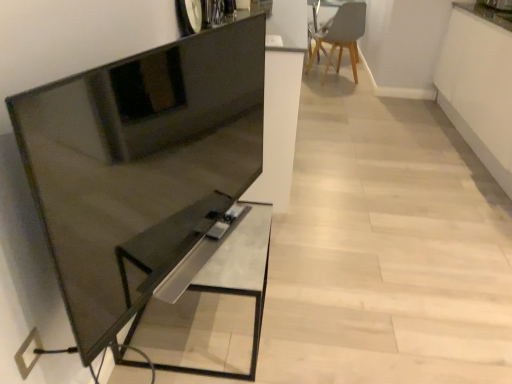
Image resolution: width=512 pixels, height=384 pixels. What do you see at coordinates (140, 165) in the screenshot?
I see `matte black tv stand at left` at bounding box center [140, 165].

The width and height of the screenshot is (512, 384). In order to click on metallic silver table at center in this screenshot , I will do `click(214, 309)`.

The width and height of the screenshot is (512, 384). I want to click on matte gray chair at upper right, so click(x=341, y=35).

Who is bigger, metallic silver table at center or matte black tv stand at left?

metallic silver table at center.

From the picture: Can you tell me how much metallic silver table at center and matte black tv stand at left differ in facing direction?

There is a 17.9-degree angle between the facing directions of metallic silver table at center and matte black tv stand at left.

Is metallic silver table at center outside of matte black tv stand at left?

metallic silver table at center lies outside matte black tv stand at left's area.

Does metallic silver table at center lie behind matte black tv stand at left?

Yes, it is.

Looking at this image, from a real-world perspective, is metallic silver table at center positioned under matte gray chair at upper right based on gravity?

Yes, from a real-world perspective, metallic silver table at center is below matte gray chair at upper right.

From the image's perspective, does metallic silver table at center appear lower than matte gray chair at upper right?

Yes.

In terms of size, does metallic silver table at center appear bigger or smaller than matte gray chair at upper right?

Considering their sizes, metallic silver table at center takes up less space than matte gray chair at upper right.

Can you confirm if metallic silver table at center is wider than matte gray chair at upper right?

In fact, metallic silver table at center might be narrower than matte gray chair at upper right.

Does matte gray chair at upper right turn towards matte black tv stand at left?

No, matte gray chair at upper right is not oriented towards matte black tv stand at left.

From a real-world perspective, between matte gray chair at upper right and matte black tv stand at left, who is vertically lower?

matte gray chair at upper right.

In the image, is matte gray chair at upper right positioned in front of or behind matte black tv stand at left?

Visually, matte gray chair at upper right is located behind matte black tv stand at left.

How different are the orientations of matte gray chair at upper right and matte black tv stand at left in degrees?

125 degrees separate the facing orientations of matte gray chair at upper right and matte black tv stand at left.

Consider the image. Considering the relative sizes of matte gray chair at upper right and metallic silver table at center in the image provided, is matte gray chair at upper right thinner than metallic silver table at center?

Incorrect, the width of matte gray chair at upper right is not less than that of metallic silver table at center.

Considering the relative sizes of matte gray chair at upper right and metallic silver table at center in the image provided, is matte gray chair at upper right bigger than metallic silver table at center?

Correct, matte gray chair at upper right is larger in size than metallic silver table at center.

Would you say matte gray chair at upper right is inside or outside metallic silver table at center?

matte gray chair at upper right is spatially situated outside metallic silver table at center.

Which is behind, point (97, 169) or point (359, 36)?

Positioned behind is point (359, 36).

Who is more distant, matte black tv stand at left or matte gray chair at upper right?

A: matte gray chair at upper right is behind.

Choose the correct answer: Is matte black tv stand at left inside matte gray chair at upper right or outside it?

matte black tv stand at left exists outside the volume of matte gray chair at upper right.

Is matte black tv stand at left at the left side of matte gray chair at upper right?

Yes, matte black tv stand at left is to the left of matte gray chair at upper right.

Is matte black tv stand at left aimed at metallic silver table at center?

No, matte black tv stand at left is not facing towards metallic silver table at center.

The width and height of the screenshot is (512, 384). Find the location of `entertainment center that appears in front of the metallic silver table at center`. entertainment center that appears in front of the metallic silver table at center is located at coordinates (140, 165).

Does matte black tv stand at left have a larger size compared to metallic silver table at center?

No.

From the picture: Who is taller, matte black tv stand at left or metallic silver table at center?

With more height is matte black tv stand at left.

Find the location of a particular element. entertainment center lying on the right of metallic silver table at center is located at coordinates (140, 165).

There is a metallic silver table at center. Where is `chair above it (from a real-world perspective)`? Image resolution: width=512 pixels, height=384 pixels. chair above it (from a real-world perspective) is located at coordinates (341, 35).

Based on their spatial positions, is metallic silver table at center or matte gray chair at upper right further from matte black tv stand at left?

The object further to matte black tv stand at left is matte gray chair at upper right.

In the scene shown: When comparing their distances from matte gray chair at upper right, does matte black tv stand at left or metallic silver table at center seem further?

metallic silver table at center is positioned further to the anchor matte gray chair at upper right.

Based on the photo, which object lies further to the anchor point matte black tv stand at left, matte gray chair at upper right or metallic silver table at center?

matte gray chair at upper right is positioned further to the anchor matte black tv stand at left.

Which object lies further to the anchor point matte gray chair at upper right, metallic silver table at center or matte black tv stand at left?

metallic silver table at center is positioned further to the anchor matte gray chair at upper right.

Estimate the real-world distances between objects in this image. Which object is further from metallic silver table at center, matte gray chair at upper right or matte black tv stand at left?

matte gray chair at upper right.

When comparing their distances from metallic silver table at center, does matte black tv stand at left or matte gray chair at upper right seem closer?

Among the two, matte black tv stand at left is located nearer to metallic silver table at center.

Locate an element on the screen. table between matte black tv stand at left and matte gray chair at upper right from front to back is located at coordinates (214, 309).